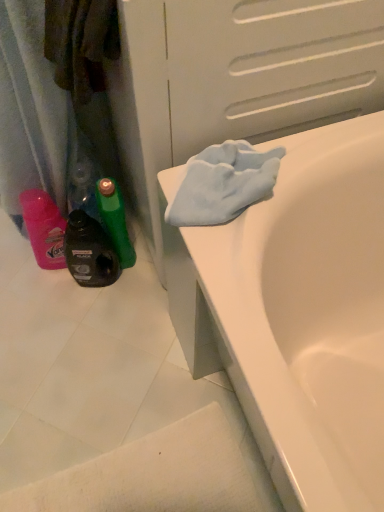
I want to click on free space in front of black plastic bottle at lower left, so click(x=87, y=331).